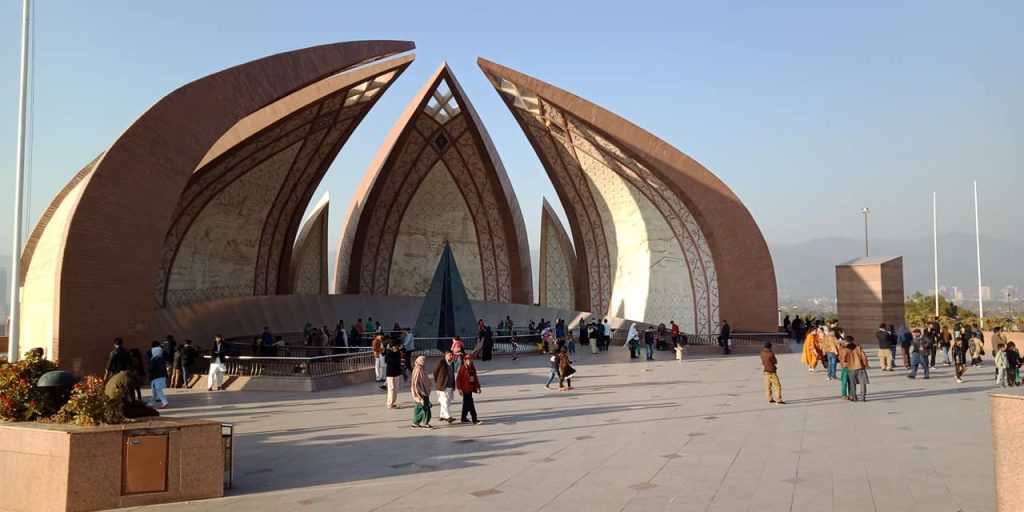
Image resolution: width=1024 pixels, height=512 pixels. In order to click on planter in this screenshot , I will do `click(122, 457)`.